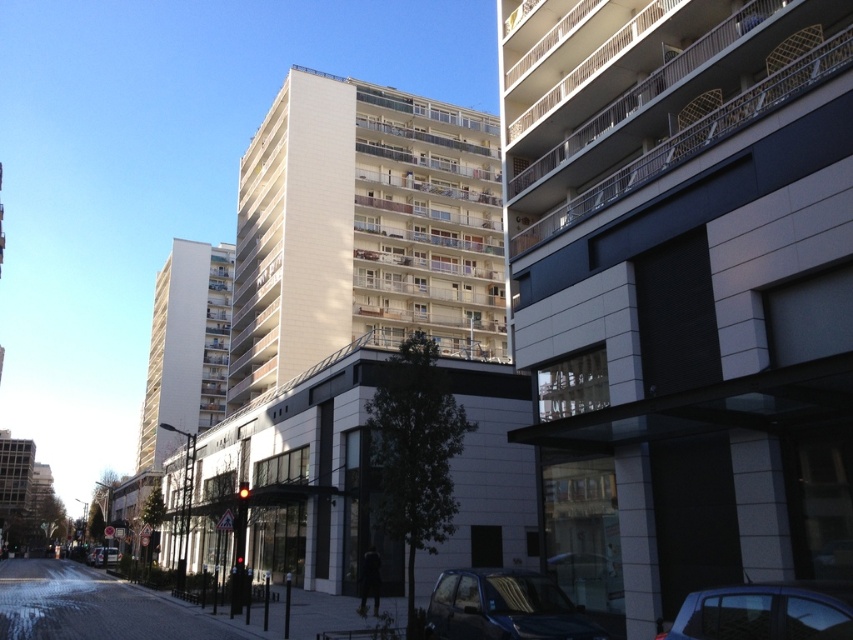
Is shiny blue car at lower center above metallic blue car at lower right?

Incorrect, shiny blue car at lower center is not positioned above metallic blue car at lower right.

Is point (479, 589) positioned behind point (689, 593)?

No, it is in front of (689, 593).

Which is behind, point (492, 577) or point (833, 616)?

The point (492, 577) is more distant.

I want to click on shiny blue car at lower center, so click(x=503, y=608).

Who is positioned more to the left, metallic blue car at lower right or metallic silver car at lower left?

Positioned to the left is metallic silver car at lower left.

Can you confirm if metallic blue car at lower right is positioned to the left of metallic silver car at lower left?

No, metallic blue car at lower right is not to the left of metallic silver car at lower left.

Which is behind, point (688, 632) or point (109, 556)?

The point (109, 556) is behind.

The height and width of the screenshot is (640, 853). In order to click on metallic blue car at lower right in this screenshot , I will do `click(766, 611)`.

Who is shorter, shiny blue car at lower center or metallic silver car at lower left?

metallic silver car at lower left is shorter.

Is point (527, 625) farther from camera compared to point (115, 557)?

No, (527, 625) is closer to viewer.

Where is `shiny blue car at lower center`? This screenshot has height=640, width=853. shiny blue car at lower center is located at coordinates (503, 608).